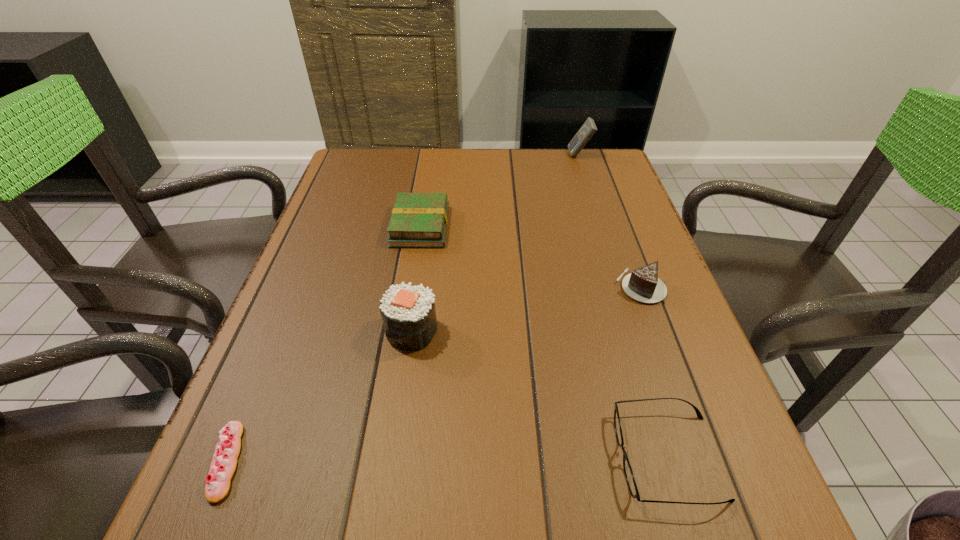
The height and width of the screenshot is (540, 960). I want to click on calculator, so click(x=588, y=129).

I want to click on the farthest object, so click(x=588, y=129).

Locate an element on the screen. sushi is located at coordinates (408, 312).

Identify the location of the third nearest object. (408, 312).

Where is `the fourth nearest object`? The height and width of the screenshot is (540, 960). the fourth nearest object is located at coordinates (643, 285).

What are the coordinates of `the second farthest object` in the screenshot? It's located at (419, 220).

You are a GUI agent. You are given a task and a screenshot of the screen. Output one action in this format:
    pyautogui.click(x=<x>, y=<y>)
    Task: Click on the third shortest object
    Image resolution: width=960 pixels, height=540 pixels.
    Given the screenshot: What is the action you would take?
    pyautogui.click(x=419, y=220)

You are a GUI agent. You are given a task and a screenshot of the screen. Output one action in this format:
    pyautogui.click(x=<x>, y=<y>)
    Task: Click on the second shortest object
    The image size is (960, 540).
    Given the screenshot: What is the action you would take?
    pyautogui.click(x=628, y=472)

Identify the location of the leftmost object. The width and height of the screenshot is (960, 540). (223, 465).

I want to click on the shortest object, so click(223, 465).